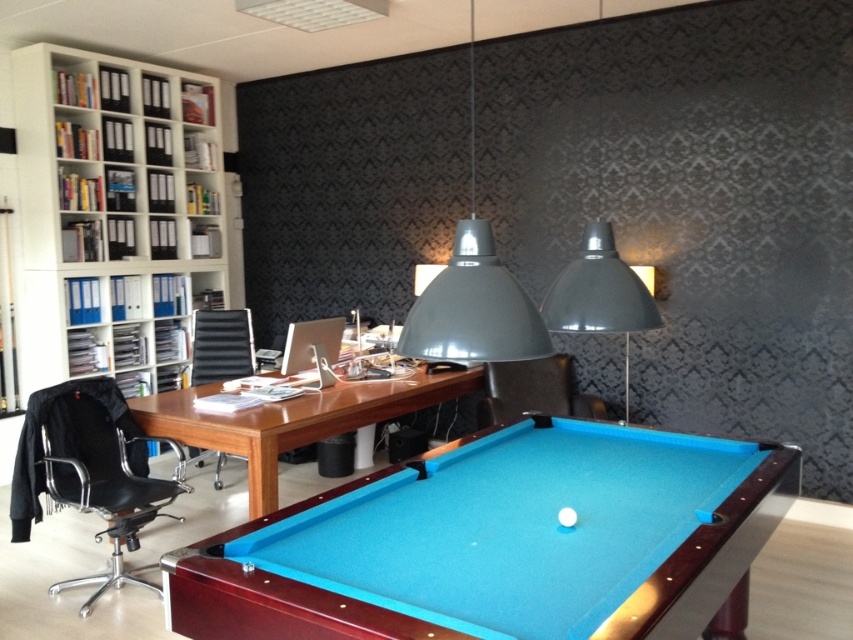
Question: Observing the image, what is the correct spatial positioning of metallic gray pendant light at center in reference to black mesh office chair at center?

Choices:
 (A) left
 (B) right

Answer: (B)

Question: Which object is positioned farthest from the matte gray lampshade at upper center?

Choices:
 (A) white plastic bookcase at upper left
 (B) leather at center

Answer: (A)

Question: Can you confirm if blue felt pool table at lower center is thinner than matte gray lampshade at upper center?

Choices:
 (A) yes
 (B) no

Answer: (B)

Question: Which point is closer to the camera?

Choices:
 (A) (241, 348)
 (B) (523, 394)
 (C) (160, 228)
 (D) (381, 564)

Answer: (D)

Question: Which object is the closest to the blue felt pool table at lower center?

Choices:
 (A) white plastic bookcase at upper left
 (B) matte gray lampshade at upper center
 (C) metallic gray pendant light at center

Answer: (B)

Question: Can you confirm if metallic gray pendant light at center is positioned above leather at center?

Choices:
 (A) yes
 (B) no

Answer: (A)